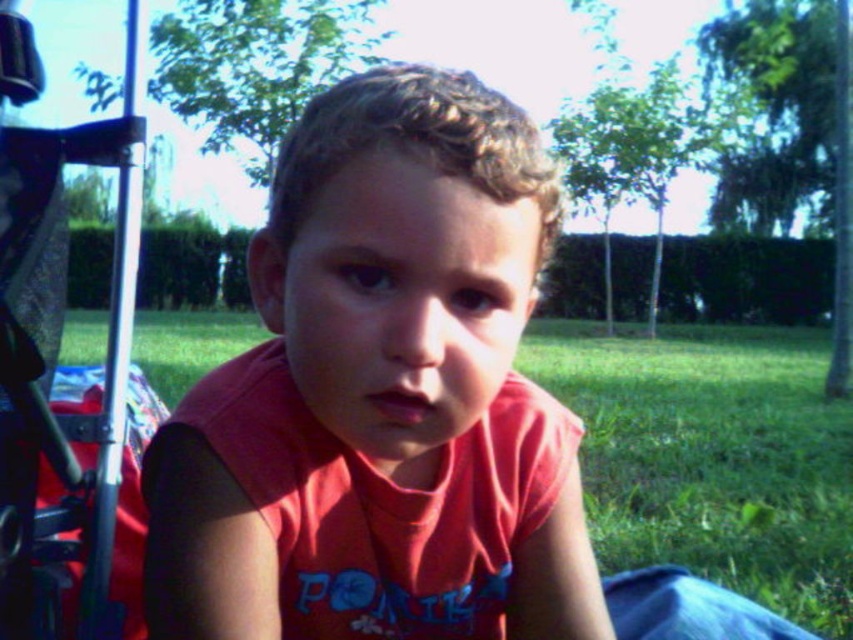
Question: Observing the image, what is the correct spatial positioning of green grass at center in reference to metallic silver baby carriage at left?

Choices:
 (A) left
 (B) right

Answer: (B)

Question: Which point is farther to the camera?

Choices:
 (A) (18, 214)
 (B) (657, 557)

Answer: (B)

Question: Is matte red shirt at center below green grass at center?

Choices:
 (A) no
 (B) yes

Answer: (A)

Question: Estimate the real-world distances between objects in this image. Which object is farther from the green grass at center?

Choices:
 (A) matte red shirt at center
 (B) metallic silver baby carriage at left

Answer: (B)

Question: Which of these objects is positioned closest to the green grass at center?

Choices:
 (A) matte red shirt at center
 (B) metallic silver baby carriage at left

Answer: (A)

Question: Does green grass at center appear over metallic silver baby carriage at left?

Choices:
 (A) yes
 (B) no

Answer: (B)